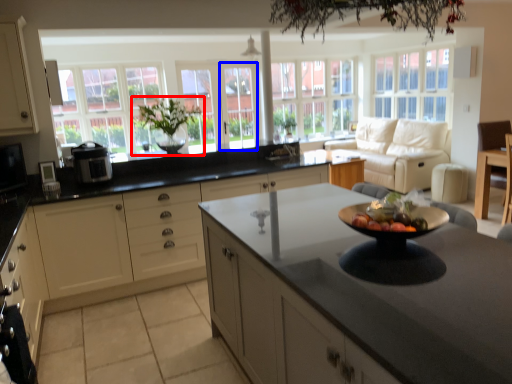
Question: Which point is further to the camera, houseplant (highlighted by a red box) or glass door (highlighted by a blue box)?

Choices:
 (A) houseplant
 (B) glass door

Answer: (B)